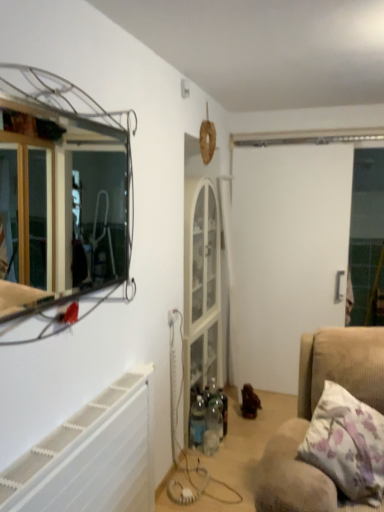
At what (x,y) coordinates should I click in order to perform the action: click on free location to the right of brown wooden toy at center. Please return your answer as a coordinate pair (x, y). This screenshot has height=512, width=384. Looking at the image, I should click on (274, 413).